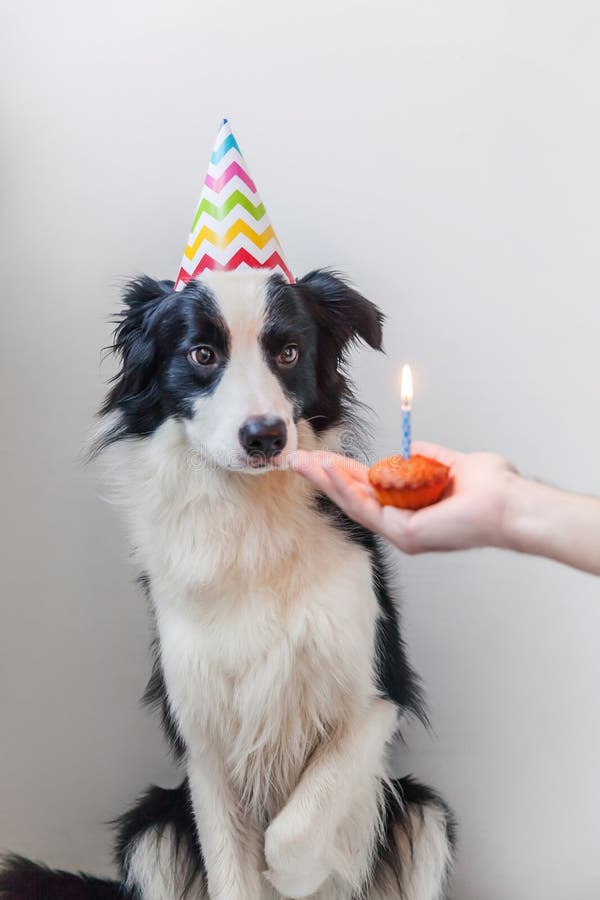
Locate an element on the screen. Image resolution: width=600 pixels, height=900 pixels. blue light birthday candle is located at coordinates (403, 430).